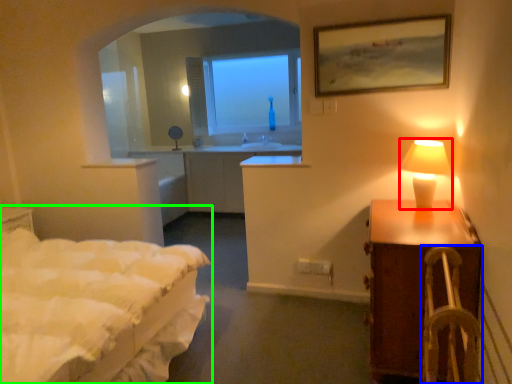
Question: Estimate the real-world distances between objects in this image. Which object is closer to table lamp (highlighted by a red box), armchair (highlighted by a blue box) or bed (highlighted by a green box)?

Choices:
 (A) armchair
 (B) bed

Answer: (A)